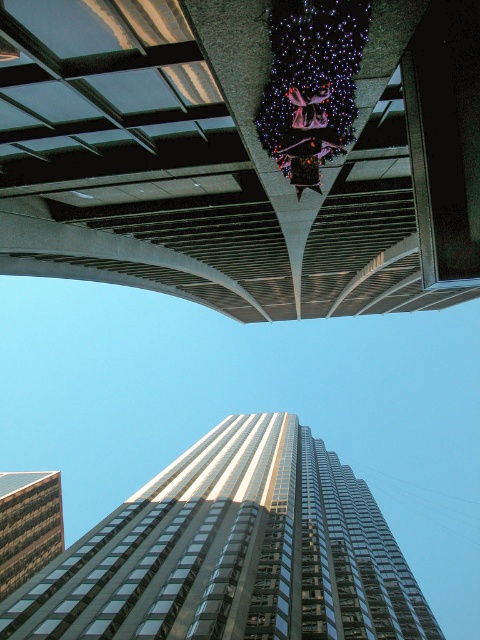
You are an architect analyzing the structural integrity of the reflective glass skyscraper at center. Considering the metallic gray overpass at upper center, which object has a narrower width?

The metallic gray overpass at upper center has a lesser width compared to the reflective glass skyscraper at center, so it is narrower.

You are standing in front of the glassy reflective building at lower left and want to see the metallic purple skateboard at center. In which direction should you turn your head to look towards it?

The metallic purple skateboard at center is to the right of the glassy reflective building at lower left, so you should turn your head to the right to look towards it.

You are standing in front of the skyscraper and want to take a photo of the metallic purple skateboard at center without the glassy reflective building at lower left appearing in the background. Is this possible given their positions?

The glassy reflective building at lower left is closer to you than the metallic purple skateboard at center, so if you position yourself so that the building is out of the frame, the skateboard can be captured without the building in the background.